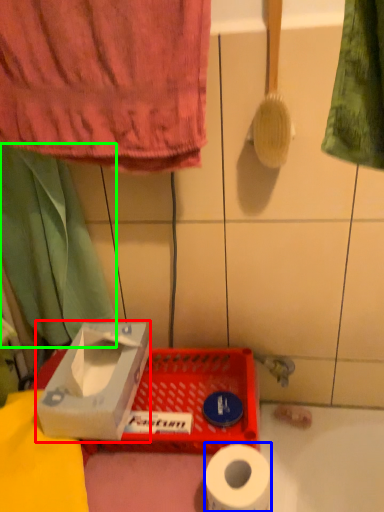
Question: Which object is positioned farthest from cardboard box (highlighted by a red box)? Select from toilet paper (highlighted by a blue box) and curtain (highlighted by a green box).

Choices:
 (A) toilet paper
 (B) curtain

Answer: (A)